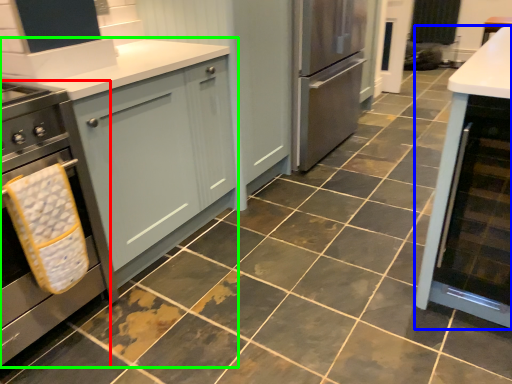
Question: Considering the real-world distances, which object is closest to home appliance (highlighted by a red box)? cabinetry (highlighted by a blue box) or cabinetry (highlighted by a green box).

Choices:
 (A) cabinetry
 (B) cabinetry

Answer: (B)